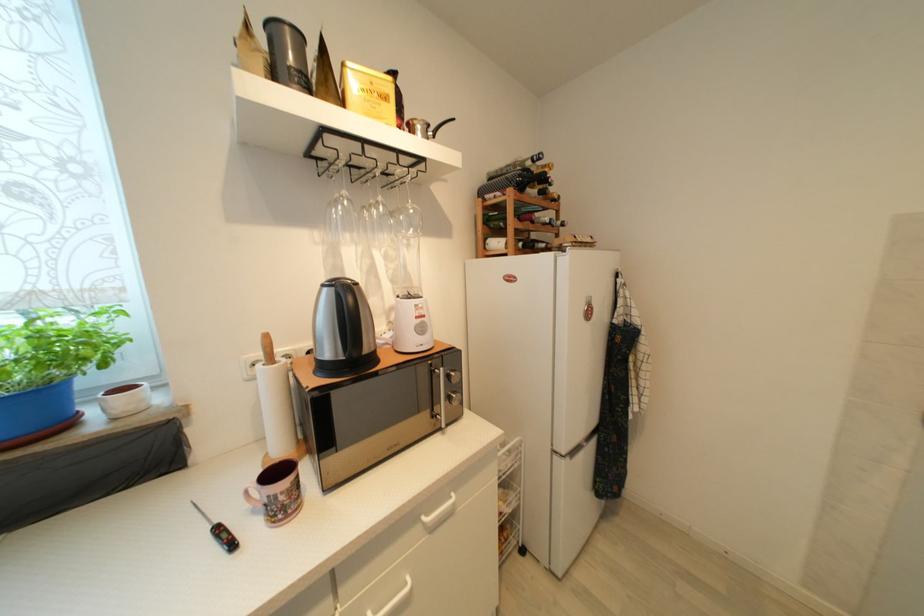
Locate an element on the screen. gold tea tin is located at coordinates (368, 92).